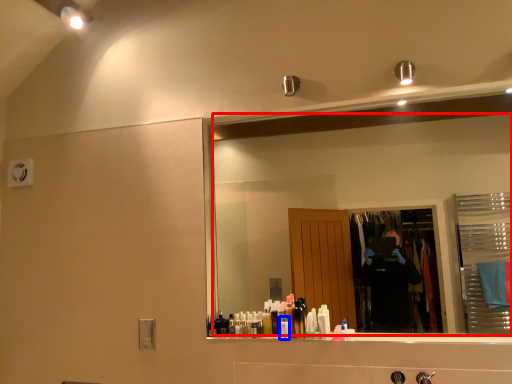
Question: Which point is further to the camera, mirror (highlighted by a red box) or toiletry (highlighted by a blue box)?

Choices:
 (A) mirror
 (B) toiletry

Answer: (B)